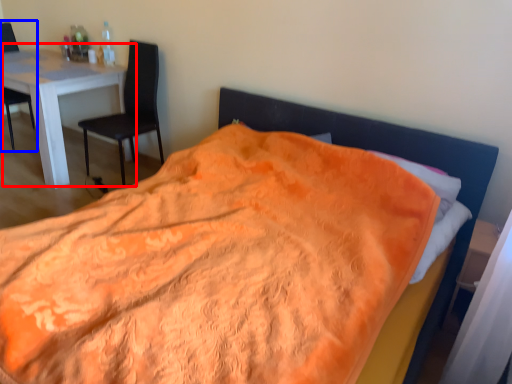
Question: Among these objects, which one is nearest to the camera, table (highlighted by a red box) or chair (highlighted by a blue box)?

Choices:
 (A) table
 (B) chair

Answer: (A)